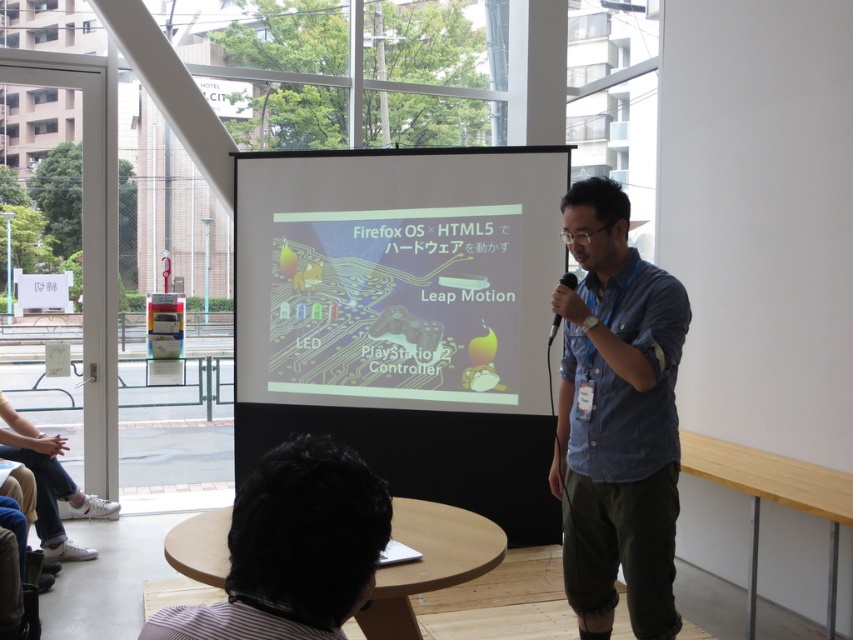
You are a photographer setting up for a video call in the conference room. The camera needs to be placed exactly 4 meters away from the white glossy projector screen at center to ensure optimal focus. Can you position the camera at the current location where the presenter is standing? Explain your reasoning.

The white glossy projector screen at center and camera are 3.93 meters apart. Since 3.93 meters is slightly less than 4 meters, positioning the camera at the presenter location would result in a distance that is 0.07 meters too close to meet the required 4 meters for optimal focus.

You are standing at the center of the room and want to move to the black striped shirt at lower left. Which direction should you turn to face it?

The black striped shirt at lower left is located at point [293,548] in 2D coordinates. Since the shirt is at lower left, you should turn to your left to face it.

You are an attendee sitting at the tables in front of the presenter. You notice the white glossy projector screen at center and the black striped shirt at lower left. Which object is taller?

The white glossy projector screen at center is taller than the black striped shirt at lower left.